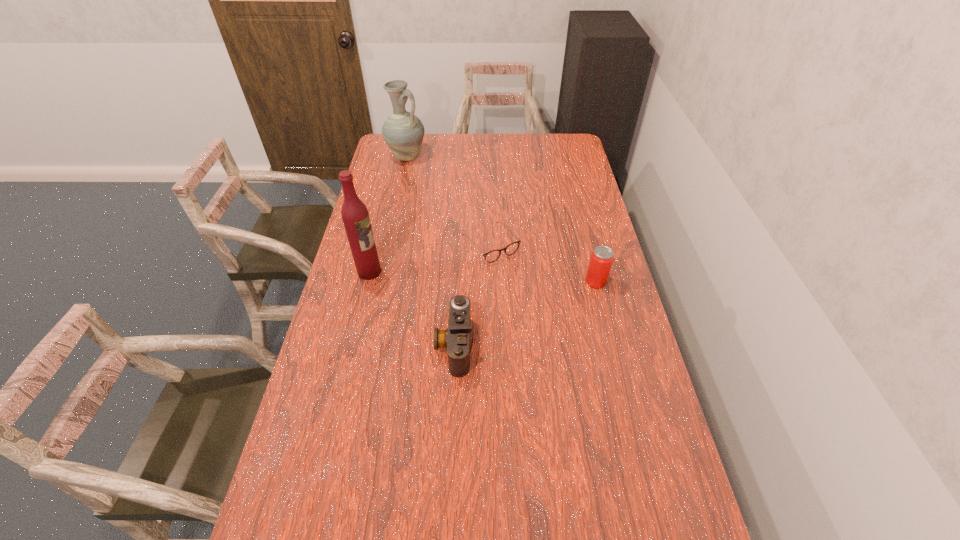
This screenshot has height=540, width=960. In order to click on unoccupied area between the spectacles and the rightmost object in this screenshot , I will do `click(543, 263)`.

Locate which object is the closest to the camera. Please provide its 2D coordinates. Your answer should be formatted as a tuple, i.e. [(x, y)], where the tuple contains the x and y coordinates of a point satisfying the conditions above.

[(492, 256)]

Identify which object is located as the second nearest to the pitcher. Please provide its 2D coordinates. Your answer should be formatted as a tuple, i.e. [(x, y)], where the tuple contains the x and y coordinates of a point satisfying the conditions above.

[(355, 216)]

This screenshot has height=540, width=960. What are the coordinates of `vacant space that satisfies the following two spatial constraints: 1. on the front side of the shortest object; 2. on the left side of the can` in the screenshot? It's located at (x=492, y=281).

Find the location of `free space that satisfies the following two spatial constraints: 1. on the back side of the liquor; 2. on the left side of the fourth shortest object`. free space that satisfies the following two spatial constraints: 1. on the back side of the liquor; 2. on the left side of the fourth shortest object is located at coordinates (397, 157).

The height and width of the screenshot is (540, 960). I want to click on free space that satisfies the following two spatial constraints: 1. on the front side of the can; 2. on the right side of the liquor, so click(x=367, y=281).

Locate an element on the screen. This screenshot has height=540, width=960. free space that satisfies the following two spatial constraints: 1. on the front side of the third tallest object; 2. on the right side of the farthest object is located at coordinates (379, 281).

This screenshot has width=960, height=540. I want to click on free spot that satisfies the following two spatial constraints: 1. on the front side of the camera; 2. on the lens of the second tallest object, so click(366, 345).